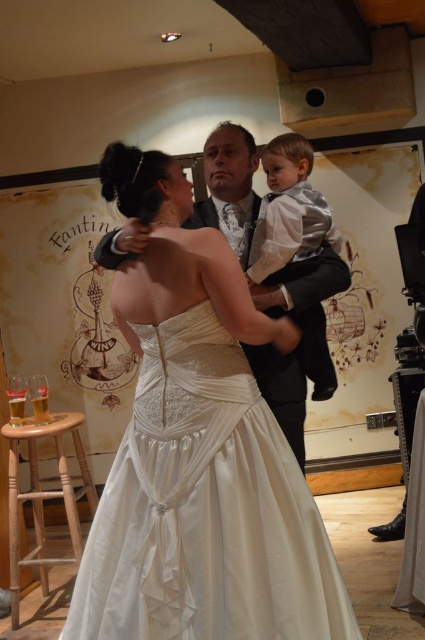
Question: Which of the following is the closest to the observer?

Choices:
 (A) satin/smooth wedding dress at center
 (B) silver textured suit at center
 (C) light brown wooden stool at lower left

Answer: (A)

Question: Can you confirm if satin/smooth wedding dress at center is bigger than light brown wooden stool at lower left?

Choices:
 (A) no
 (B) yes

Answer: (B)

Question: Is matte black suit at center positioned behind silver textured suit at center?

Choices:
 (A) yes
 (B) no

Answer: (A)

Question: Which of the following is the farthest from the observer?

Choices:
 (A) matte black suit at center
 (B) satin/smooth wedding dress at center

Answer: (A)

Question: Is satin/smooth wedding dress at center behind silver textured suit at center?

Choices:
 (A) no
 (B) yes

Answer: (A)

Question: Among these objects, which one is nearest to the camera?

Choices:
 (A) silver textured suit at center
 (B) satin/smooth wedding dress at center

Answer: (B)